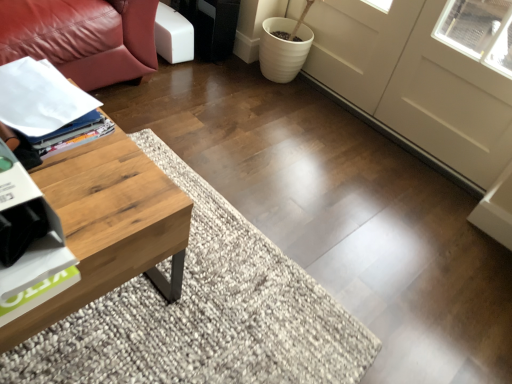
I want to click on free space to the right of white glossy magazine at left, so click(116, 181).